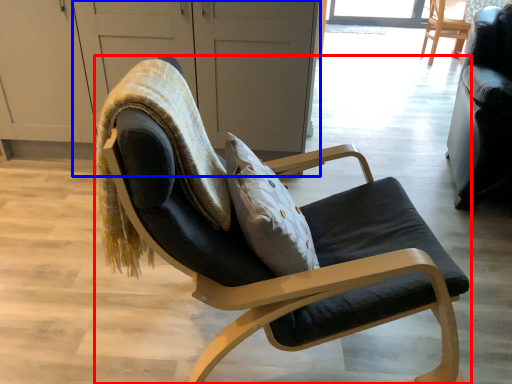
Question: Which object appears closest to the camera in this image, chair (highlighted by a red box) or screen door (highlighted by a blue box)?

Choices:
 (A) chair
 (B) screen door

Answer: (A)